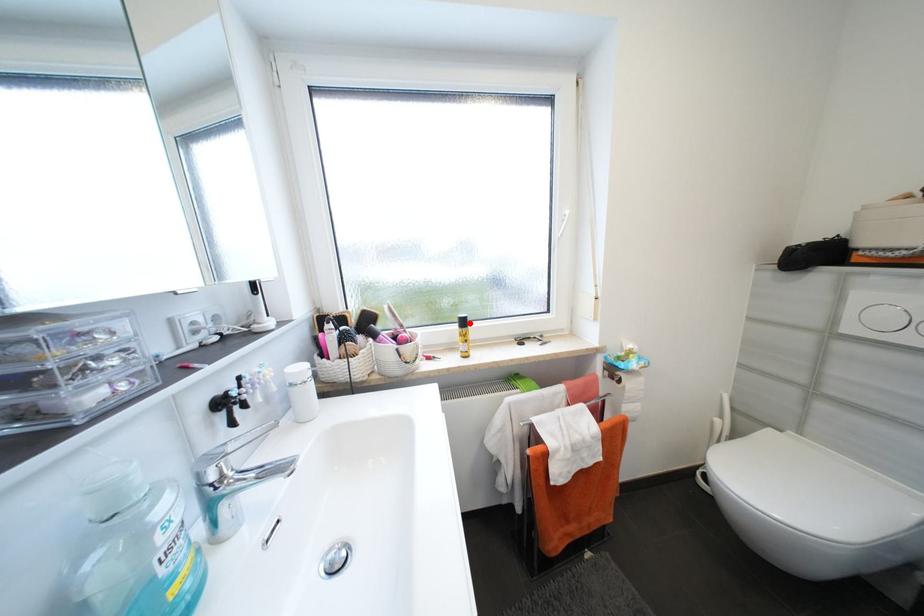
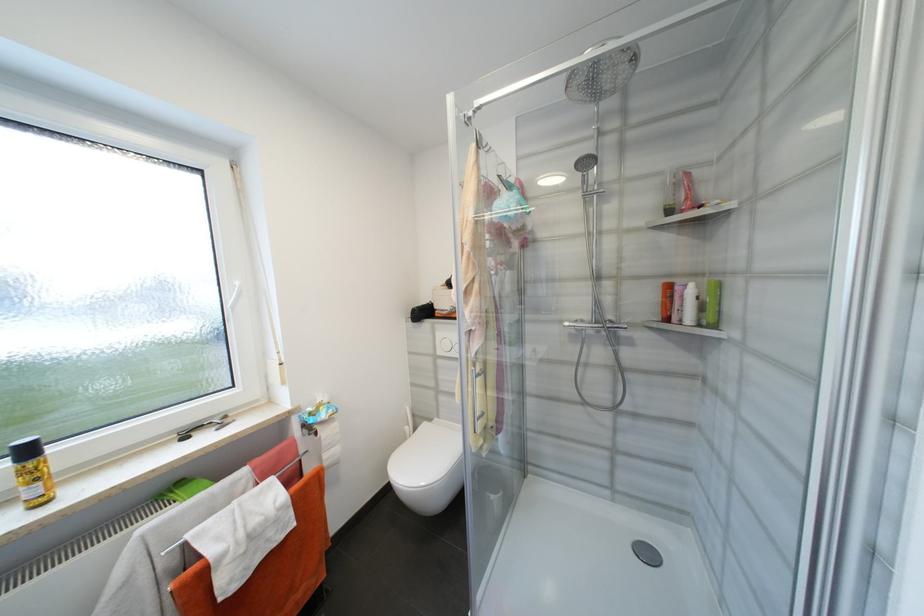
In the second image, find the point that corresponds to the highlighted location in the first image.

(33, 453)